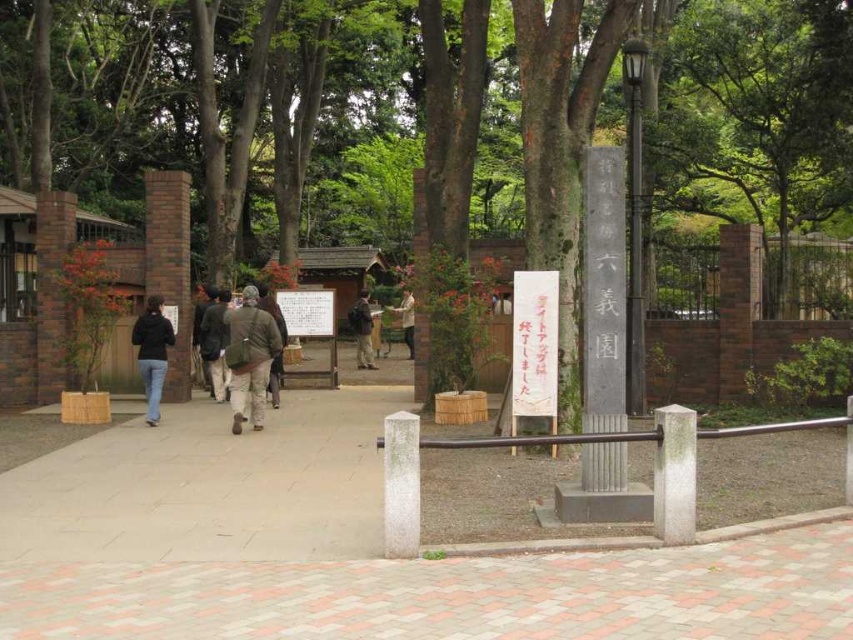
Question: Does brick wall at left have a smaller size compared to dark brown jacket at center?

Choices:
 (A) yes
 (B) no

Answer: (B)

Question: Which point is farther from the camera taking this photo?

Choices:
 (A) (144, 384)
 (B) (242, 394)
 (C) (279, 362)
 (D) (418, 483)

Answer: (C)

Question: Can you confirm if brick paving at center is thinner than khaki cotton jacket at center?

Choices:
 (A) no
 (B) yes

Answer: (A)

Question: Among these objects, which one is nearest to the camera?

Choices:
 (A) dark blue jeans at center
 (B) camouflage jacket at center
 (C) brick paving at center

Answer: (C)

Question: Can you confirm if white paper sign at center is thinner than brown woolen jacket at center?

Choices:
 (A) no
 (B) yes

Answer: (B)

Question: Based on their relative distances, which object is farther from the polished metal pole at upper right?

Choices:
 (A) brick paving at center
 (B) brick wall at left

Answer: (B)